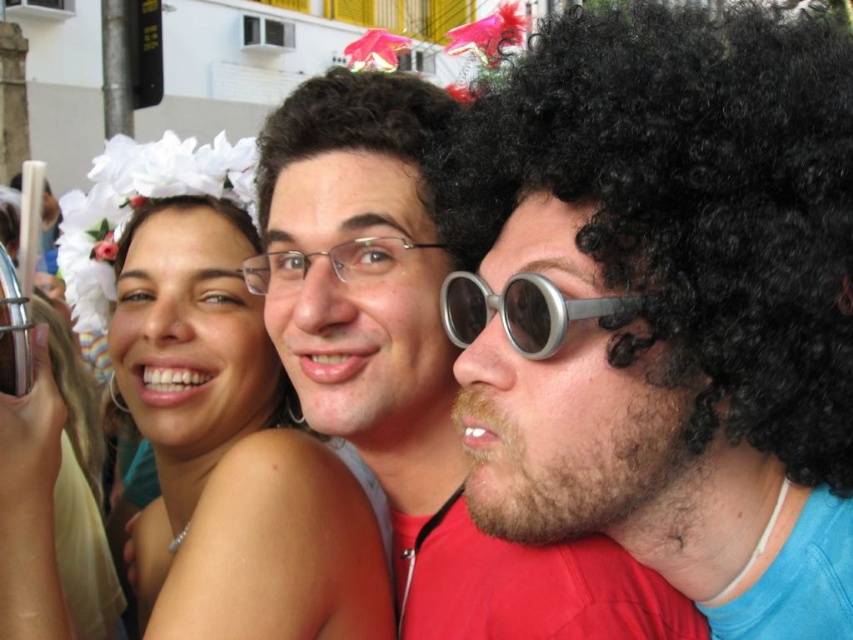
Who is more forward, (x=115, y=349) or (x=554, y=314)?

Point (x=554, y=314) is in front.

Does smooth skin at center lie in front of metallic silver goggles at center?

That is False.

Which is in front, point (200, 497) or point (515, 288)?

Point (515, 288)

Identify the location of smooth skin at center. The width and height of the screenshot is (853, 640). (231, 451).

Can you confirm if dark curly hair at center is positioned to the right of metallic silver goggles at center?

In fact, dark curly hair at center is to the left of metallic silver goggles at center.

Is dark curly hair at center smaller than metallic silver goggles at center?

Incorrect, dark curly hair at center is not smaller in size than metallic silver goggles at center.

Find the location of `dark curly hair at center`. dark curly hair at center is located at coordinates (357, 125).

Between point (701, 42) and point (213, 390), which one is positioned in front?

Positioned in front is point (701, 42).

Does black curly wig at right have a greater height compared to smooth skin at center?

In fact, black curly wig at right may be shorter than smooth skin at center.

This screenshot has height=640, width=853. What are the coordinates of `black curly wig at right` in the screenshot? It's located at (691, 208).